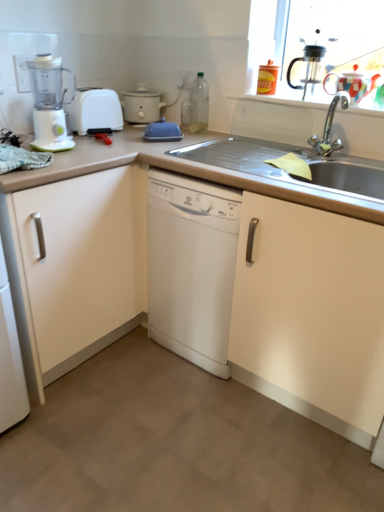
I want to click on vacant region in front of white plastic blender at left, so click(51, 152).